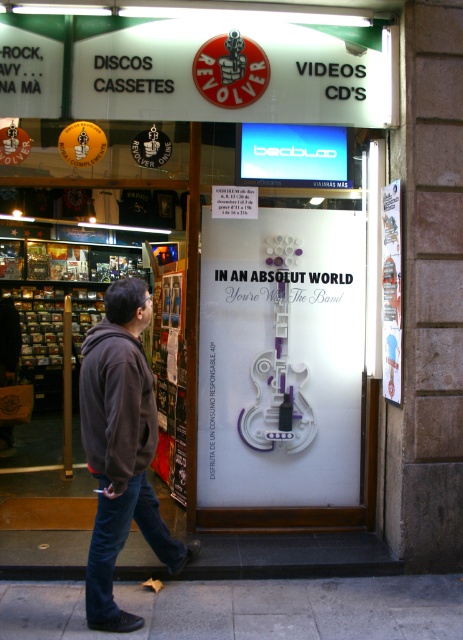
You are a customer entering the Revolver store and see the white paper guitar at center and the dark blue denim jeans at lower left. Which object is bigger?

The white paper guitar at center is larger in size than the dark blue denim jeans at lower left.

You are a delivery person trying to place a large box on the ground. You see the white paper guitar at center and the gray concrete pavement at lower center. Which surface is wider to place the box?

The gray concrete pavement at lower center is wider than the white paper guitar at center, so the box should be placed on the gray concrete pavement at lower center.